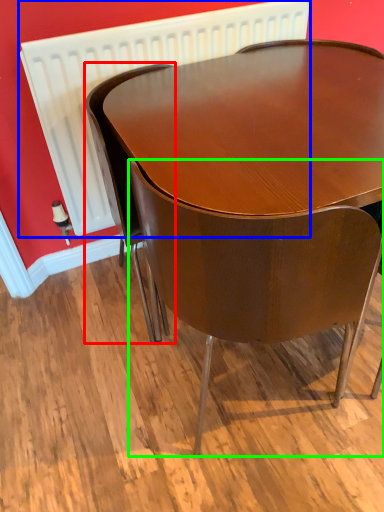
Question: Considering the real-world distances, which object is closest to chair (highlighted by a red box)? radiator (highlighted by a blue box) or chair (highlighted by a green box).

Choices:
 (A) radiator
 (B) chair

Answer: (A)